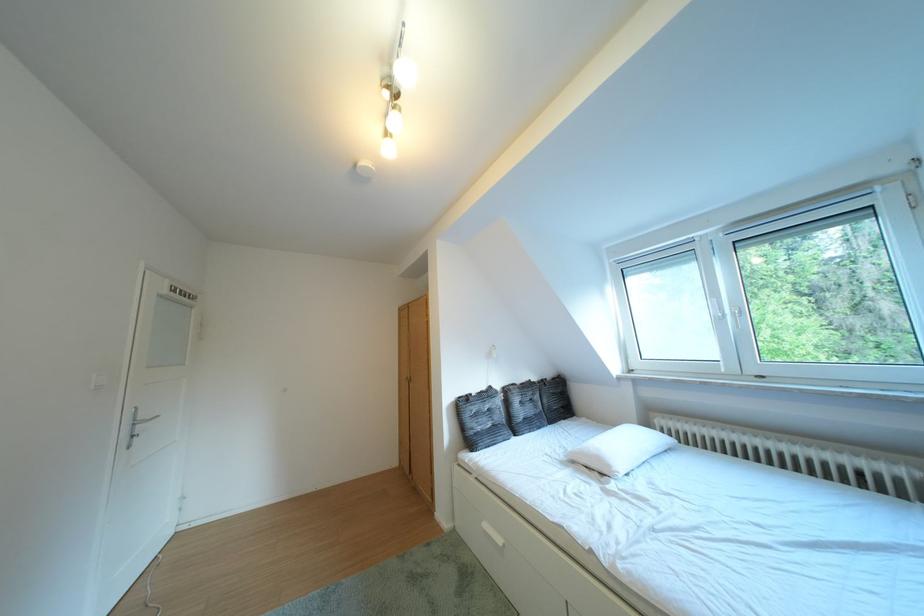
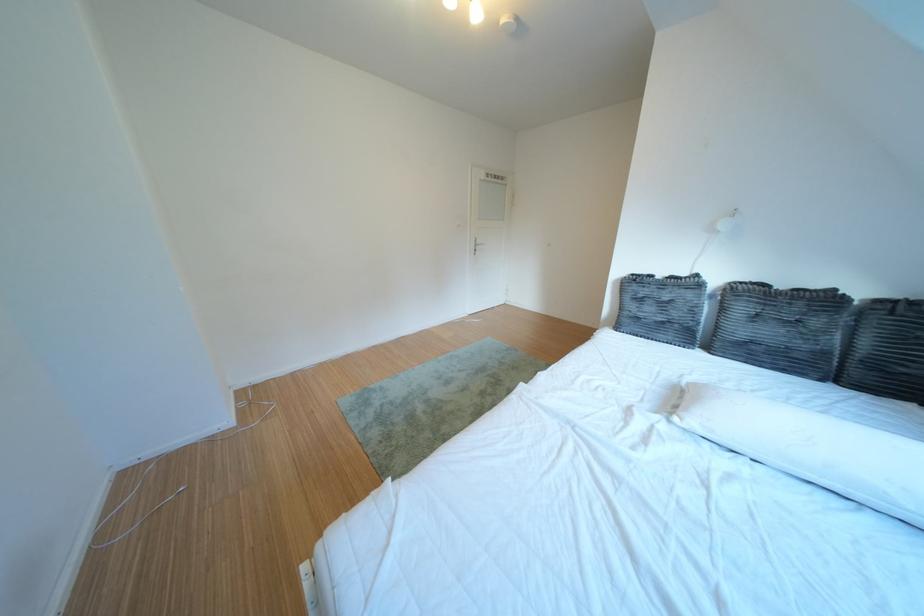
Where in the second image is the point corresponding to pixel 484 438 from the first image?

(639, 318)